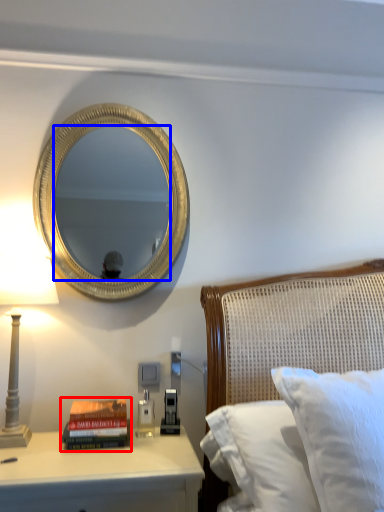
Question: Which point is closer to the camera, paperback book (highlighted by a red box) or mirror (highlighted by a blue box)?

Choices:
 (A) paperback book
 (B) mirror

Answer: (A)